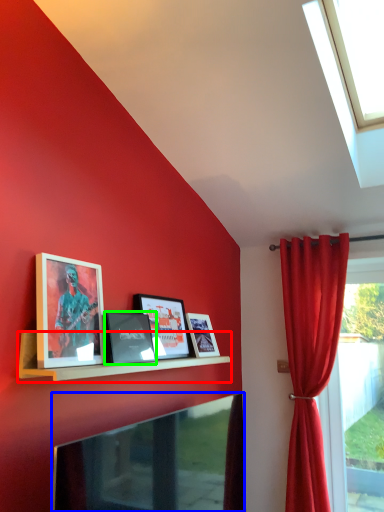
Question: Based on their relative distances, which object is farther from shelf (highlighted by a red box)? Choose from television (highlighted by a blue box) and picture frame (highlighted by a green box).

Choices:
 (A) television
 (B) picture frame

Answer: (A)